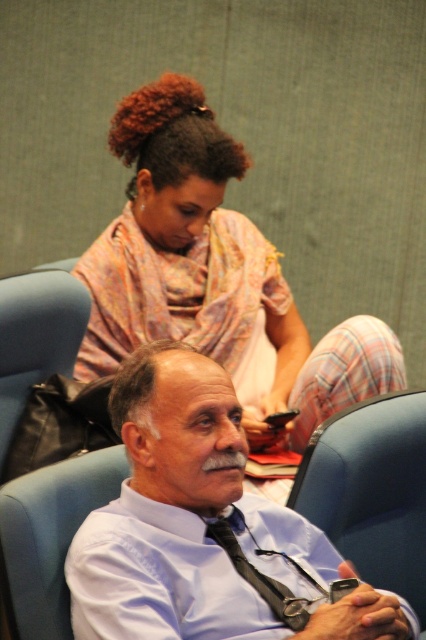
You are designing a new uniform for a corporate office. The uniform must fit snugly around the torso. You have two fabric options available. The first is the light blue shirt at center, and the second is the printed silk blouse at upper center. Which fabric should you choose to ensure a snug fit?

The light blue shirt at center is thinner than the printed silk blouse at upper center, so the light blue shirt at center would be better for a snug fit as it can conform more closely to the body.

You are standing in the conference room and need to locate the light blue shirt at center. According to the coordinates provided, where would you find it?

The light blue shirt at center is located at the 2D coordinates point (206, 529).